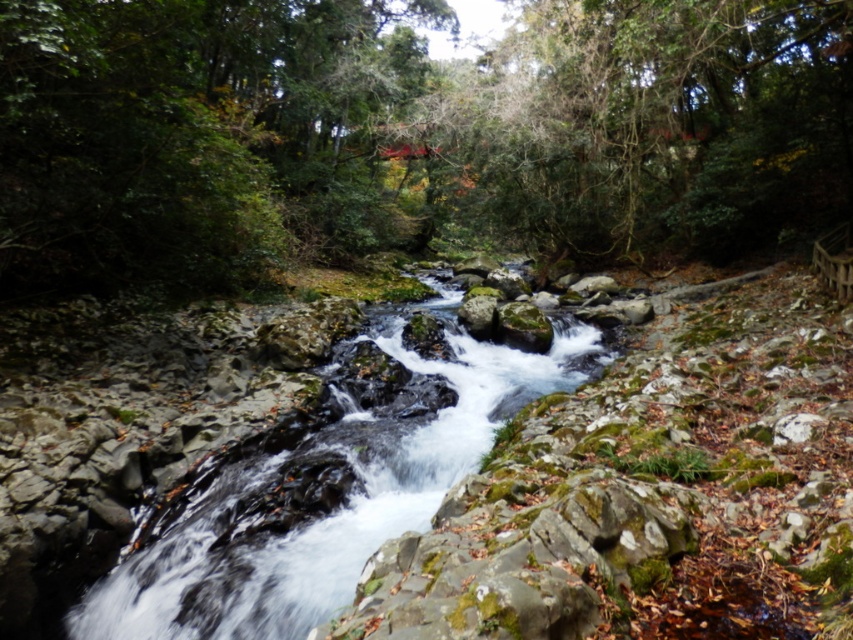
You are a photographer standing at the edge of the stream in the scene. You want to take a photo that includes both the point at coordinates point (x=746, y=131) and point (x=798, y=412). To ensure both points are in focus, which point should you focus on first?

You should focus on point (x=746, y=131) first because it is closer to the camera than point (x=798, y=412). Since it is closer, focusing on it first will help ensure both points are within the depth of field.

You are standing at the origin point in the scene. Which direction should you move to reach the green leafy tree at center?

The green leafy tree at center is located at point 0.208 on the x and 0.479 on the y. Since you are at the origin, you should move right along the x axis and up along the y axis to reach it.

You are planning to place a small garden bench between the green leafy tree at center and the smooth rock stream at center. Based on their widths, which object should you position closer to the bench to ensure it fits comfortably?

The green leafy tree at center is wider than the smooth rock stream at center, so positioning the bench closer to the narrower smooth rock stream at center would provide more space and ensure a comfortable fit.